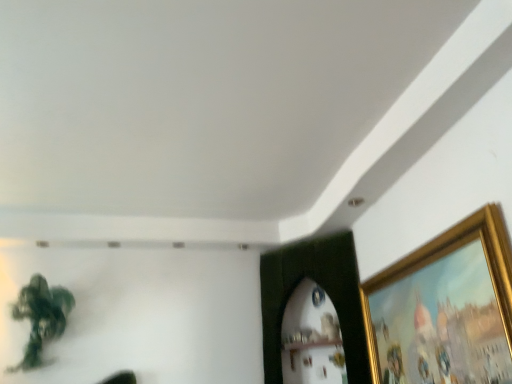
Question: Considering the positions of point (448, 261) and point (40, 319), is point (448, 261) closer or farther from the camera than point (40, 319)?

Choices:
 (A) closer
 (B) farther

Answer: (A)

Question: From their relative heights in the image, would you say gold metallic picture frame at upper right is taller or shorter than green matte plant at upper left?

Choices:
 (A) tall
 (B) short

Answer: (B)

Question: From a real-world perspective, is gold metallic picture frame at upper right positioned above or below green matte plant at upper left?

Choices:
 (A) below
 (B) above

Answer: (A)

Question: Is green matte plant at upper left spatially inside gold metallic picture frame at upper right, or outside of it?

Choices:
 (A) inside
 (B) outside

Answer: (B)

Question: Looking at the image, does green matte plant at upper left seem bigger or smaller compared to gold metallic picture frame at upper right?

Choices:
 (A) small
 (B) big

Answer: (B)

Question: Is green matte plant at upper left in front of or behind gold metallic picture frame at upper right in the image?

Choices:
 (A) front
 (B) behind

Answer: (B)

Question: From a real-world perspective, relative to gold metallic picture frame at upper right, is green matte plant at upper left vertically above or below?

Choices:
 (A) below
 (B) above

Answer: (B)